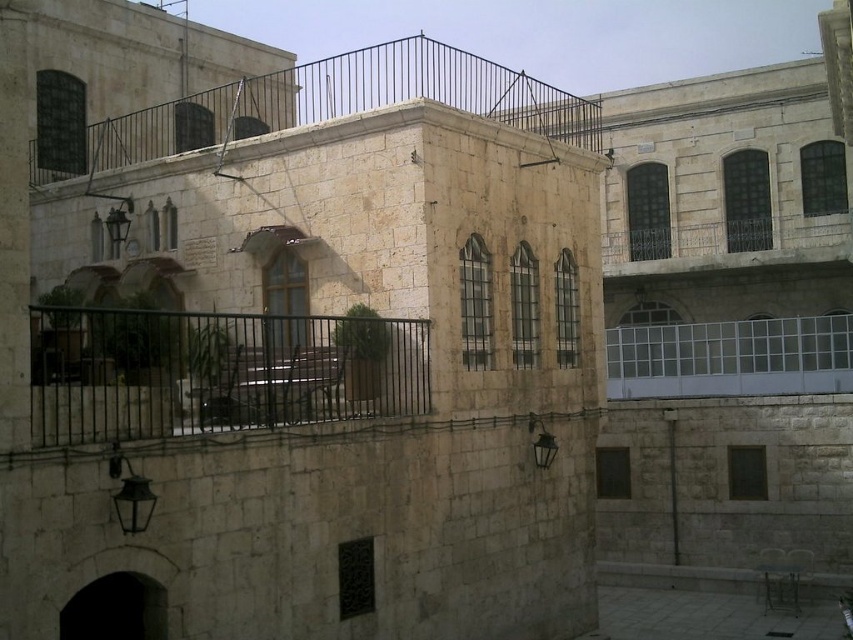
Question: Among these points, which one is nearest to the camera?

Choices:
 (A) (132, 314)
 (B) (50, 164)
 (C) (782, 378)

Answer: (A)

Question: Can you confirm if black metal bench at center is bigger than clear glass balcony at center?

Choices:
 (A) no
 (B) yes

Answer: (A)

Question: Is black metal bench at center below clear glass balcony at center?

Choices:
 (A) yes
 (B) no

Answer: (B)

Question: Is rustic stone balcony at upper center to the left of clear glass balcony at center from the viewer's perspective?

Choices:
 (A) yes
 (B) no

Answer: (A)

Question: Which point is farther to the camera?

Choices:
 (A) (204, 125)
 (B) (325, 326)
 (C) (627, 333)

Answer: (A)

Question: Which of the following is the farthest from the observer?

Choices:
 (A) clear glass balcony at center
 (B) black metal bench at center
 (C) rustic stone balcony at upper center

Answer: (A)